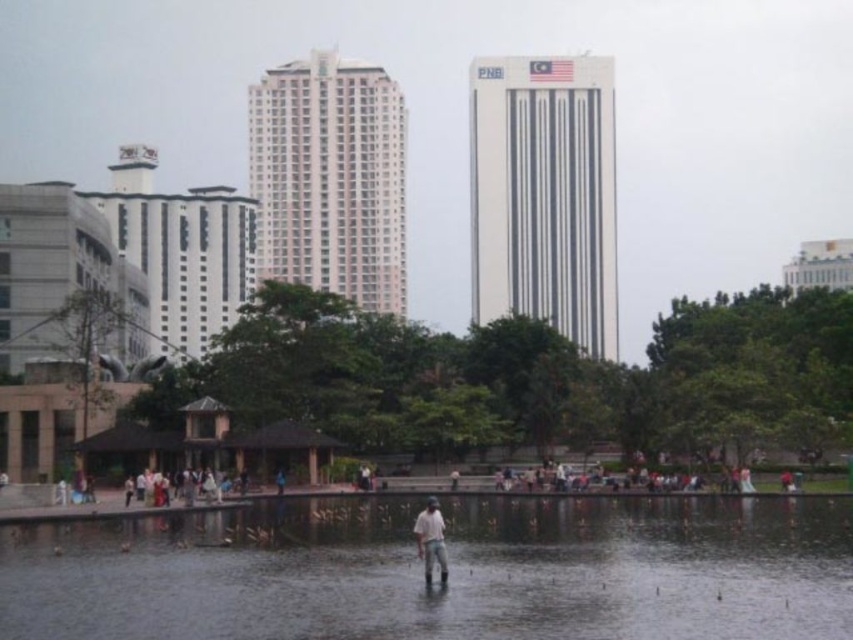
Does transparent water at center have a greater width compared to light brown fabric shirt at center?

Indeed, transparent water at center has a greater width compared to light brown fabric shirt at center.

Which is behind, point (172, 584) or point (428, 515)?

The point (428, 515) is behind.

Measure the distance between transparent water at center and camera.

transparent water at center is 31.44 meters away from camera.

The width and height of the screenshot is (853, 640). In order to click on transparent water at center in this screenshot , I will do `click(437, 572)`.